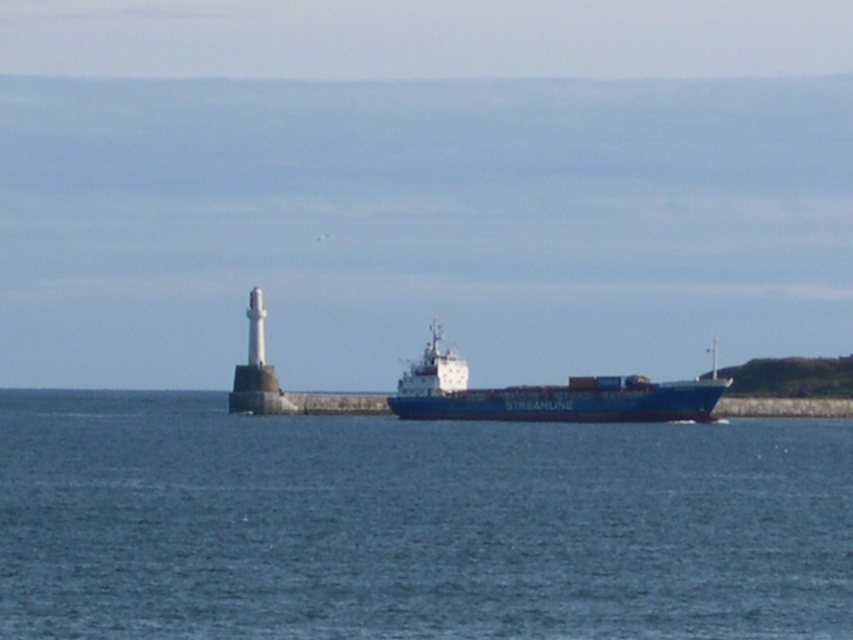
Does blue water at center appear under blue matte container ship at center?

Yes, blue water at center is below blue matte container ship at center.

Does blue water at center have a smaller size compared to blue matte container ship at center?

Correct, blue water at center occupies less space than blue matte container ship at center.

Between point (403, 486) and point (685, 387), which one is positioned in front?

Point (403, 486) is more forward.

At what (x,y) coordinates should I click in order to perform the action: click on blue water at center. Please return your answer as a coordinate pair (x, y). Looking at the image, I should click on (413, 524).